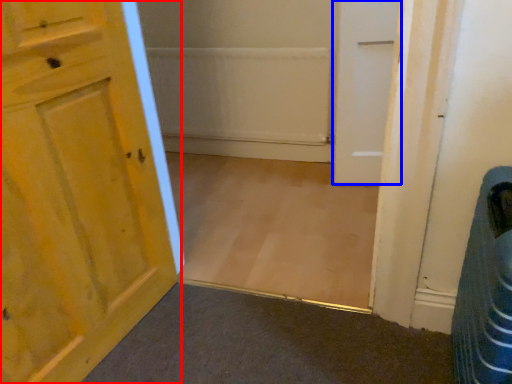
Question: Which object appears farthest to the camera in this image, door (highlighted by a red box) or door (highlighted by a blue box)?

Choices:
 (A) door
 (B) door

Answer: (B)